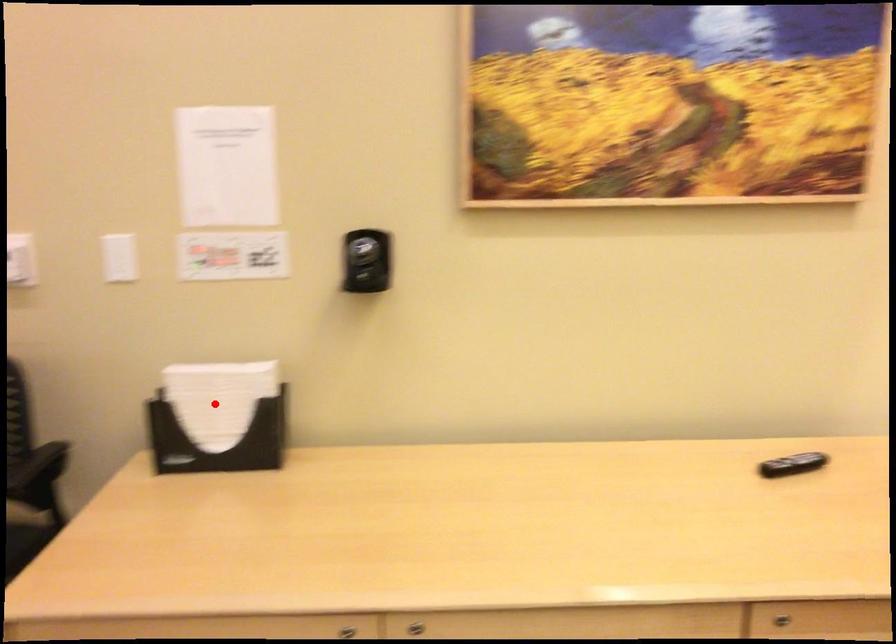
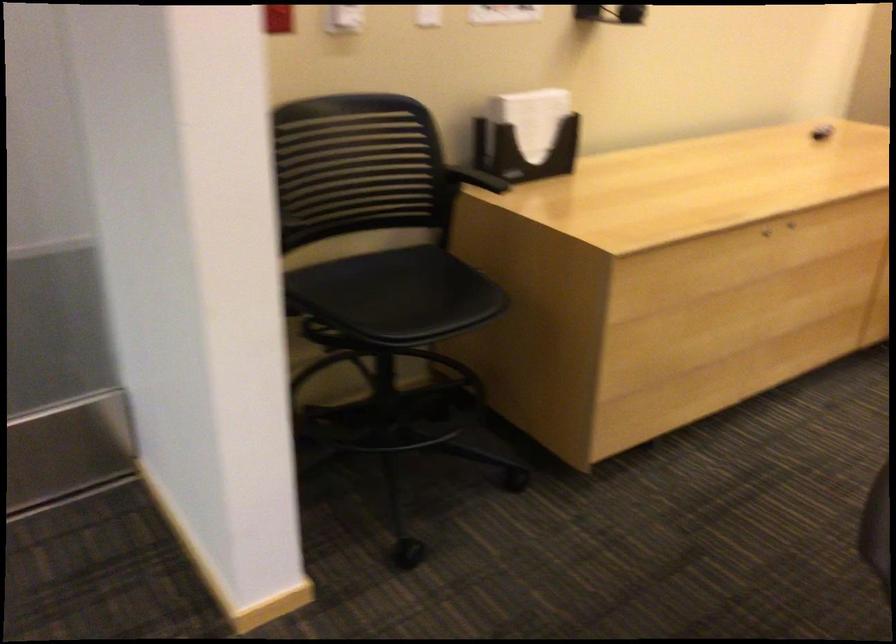
The point at the highlighted location is marked in the first image. Where is the corresponding point in the second image?

(531, 118)